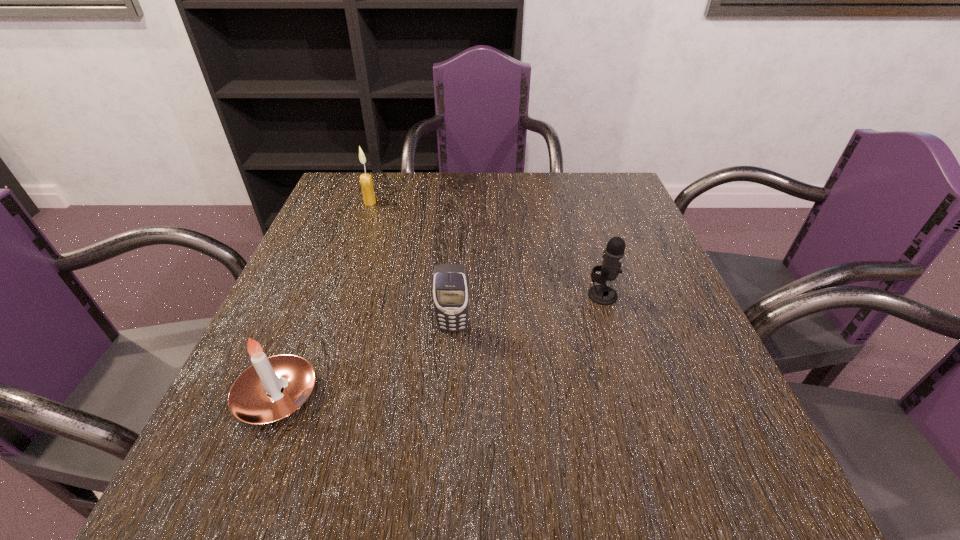
Locate an element on the screen. vacant area that lies between the rightmost object and the second object from right to left is located at coordinates (528, 312).

This screenshot has height=540, width=960. What are the coordinates of `vacant point located between the farthest object and the cellular telephone` in the screenshot? It's located at (412, 265).

At what (x,y) coordinates should I click in order to perform the action: click on vacant region between the rightmost object and the nearest object. Please return your answer as a coordinate pair (x, y). Looking at the image, I should click on (440, 346).

Where is `vacant space in between the microphone and the farther candle`? The width and height of the screenshot is (960, 540). vacant space in between the microphone and the farther candle is located at coordinates (487, 249).

At what (x,y) coordinates should I click in order to perform the action: click on free space that is in between the nearer candle and the third nearest object. Please return your answer as a coordinate pair (x, y). The width and height of the screenshot is (960, 540). Looking at the image, I should click on (440, 346).

At what (x,y) coordinates should I click in order to perform the action: click on free point between the third nearest object and the second nearest object. Please return your answer as a coordinate pair (x, y). The image size is (960, 540). Looking at the image, I should click on click(x=528, y=312).

Where is `vacant space in between the farthest object and the second nearest object`? Image resolution: width=960 pixels, height=540 pixels. vacant space in between the farthest object and the second nearest object is located at coordinates (412, 265).

Find the location of a particular element. The width and height of the screenshot is (960, 540). free space that is in between the nearer candle and the farther candle is located at coordinates (324, 299).

Image resolution: width=960 pixels, height=540 pixels. I want to click on empty location between the third object from left to right and the rightmost object, so click(528, 312).

Locate which object is the second closest to the farther candle. Please provide its 2D coordinates. Your answer should be formatted as a tuple, i.e. [(x, y)], where the tuple contains the x and y coordinates of a point satisfying the conditions above.

[(272, 388)]